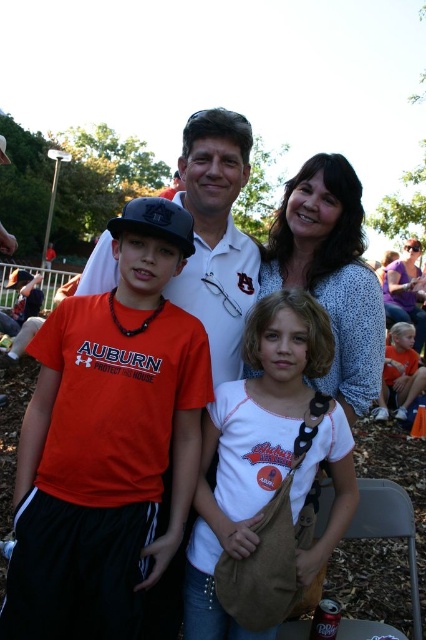
You are standing in the park and see two points marked in the image. Which point is nearer to you, point 1 at coordinates (172, 477) or point 2 at coordinates (333, 266)?

Point 1 at coordinates (172, 477) is closer to the viewer than point 2 at coordinates (333, 266).